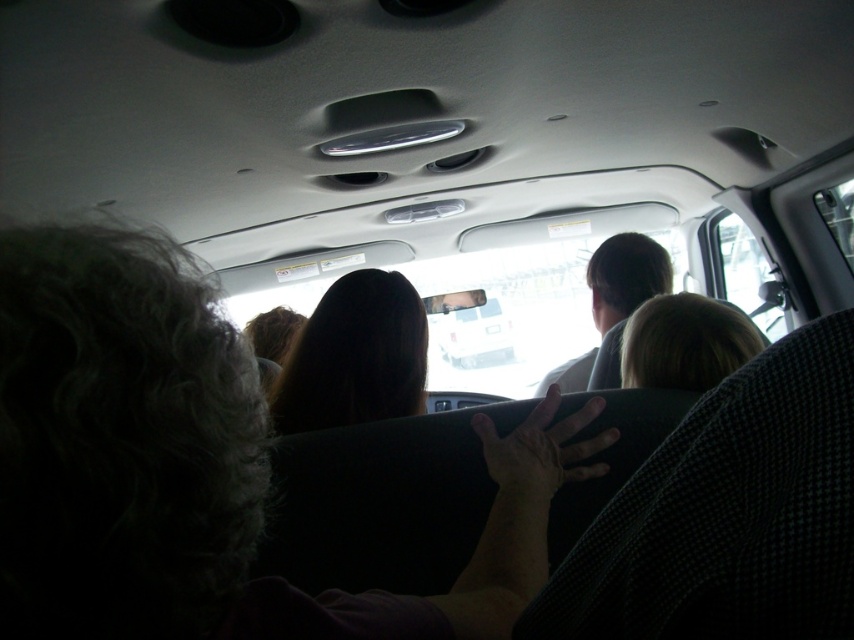
You are a passenger in the vehicle and want to know if the person with dark brown hair at center is sitting in front of or behind the person with light brown hair at center. Based on the scene description, can you determine their positions?

The dark brown hair at center is positioned over light brown hair at center, which means the person with dark brown hair at center is sitting in front of the light brown hair at center.

You are a photographer trying to capture a group photo of the passengers in the vehicle. You notice two people with dark brown hair at center and light brown hair at center. Which person would require a wider angle lens to capture their full head and shoulders in the photo?

The light brown hair at center requires a wider angle lens because it has a greater width compared to the dark brown hair at center, meaning it occupies more space in the frame and might need a wider angle to capture fully.